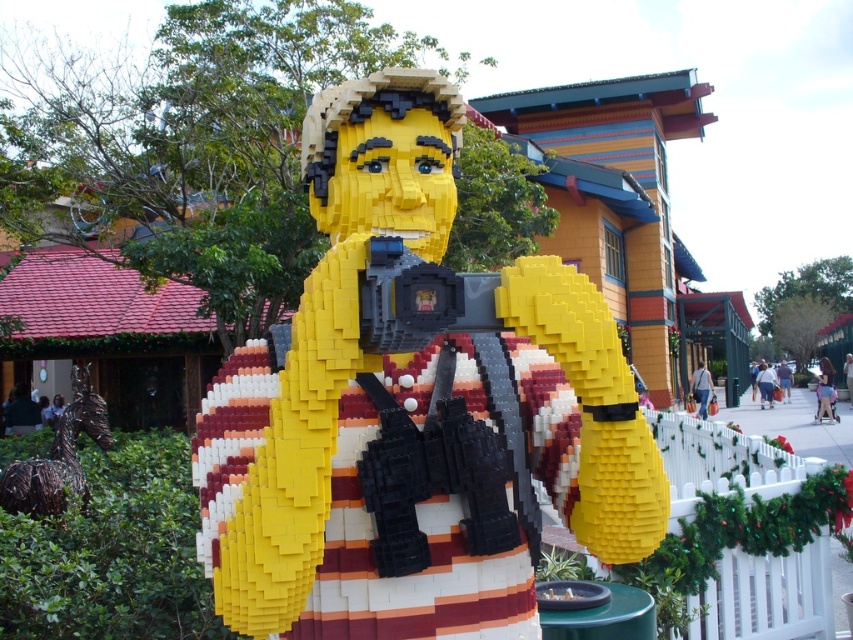
Question: Is yellow matte lego figure at center smaller than bronze horse at lower left?

Choices:
 (A) no
 (B) yes

Answer: (B)

Question: Is yellow matte lego figure at center thinner than bronze horse at lower left?

Choices:
 (A) no
 (B) yes

Answer: (A)

Question: Is yellow matte lego figure at center closer to camera compared to bronze horse at lower left?

Choices:
 (A) yes
 (B) no

Answer: (A)

Question: Which object is farther from the camera taking this photo?

Choices:
 (A) bronze horse at lower left
 (B) yellow matte lego figure at center

Answer: (A)

Question: Among these points, which one is nearest to the camera?

Choices:
 (A) (33, 484)
 (B) (444, 269)

Answer: (B)

Question: Among these objects, which one is nearest to the camera?

Choices:
 (A) bronze horse at lower left
 (B) yellow matte lego figure at center

Answer: (B)